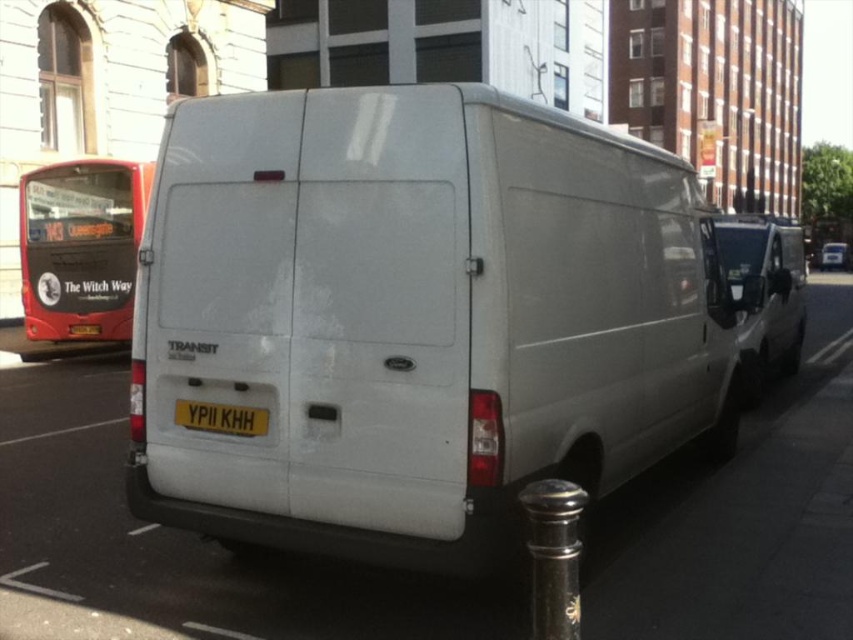
Is white matte van at center thinner than yellow metallic license plate at center?

No.

Does white matte van at center appear on the left side of yellow metallic license plate at center?

In fact, white matte van at center is to the right of yellow metallic license plate at center.

Is point (306, 394) less distant than point (184, 422)?

Yes, it is.

This screenshot has height=640, width=853. Identify the location of white matte van at center. (415, 317).

Can you confirm if red painted metal bus at left is positioned to the right of polished metal pole at lower right?

In fact, red painted metal bus at left is to the left of polished metal pole at lower right.

Which is behind, point (90, 241) or point (529, 561)?

Point (90, 241)

Which is in front, point (67, 212) or point (544, 580)?

Point (544, 580) is in front.

You are a GUI agent. You are given a task and a screenshot of the screen. Output one action in this format:
    pyautogui.click(x=<x>, y=<y>)
    Task: Click on the red painted metal bus at left
    This screenshot has width=853, height=640.
    Given the screenshot: What is the action you would take?
    pyautogui.click(x=80, y=248)

Is point (32, 326) farther from viewer compared to point (743, 276)?

Yes, it is.

Between point (50, 244) and point (778, 356), which one is positioned behind?

The point (50, 244) is behind.

Identify the location of red painted metal bus at left. The height and width of the screenshot is (640, 853). (80, 248).